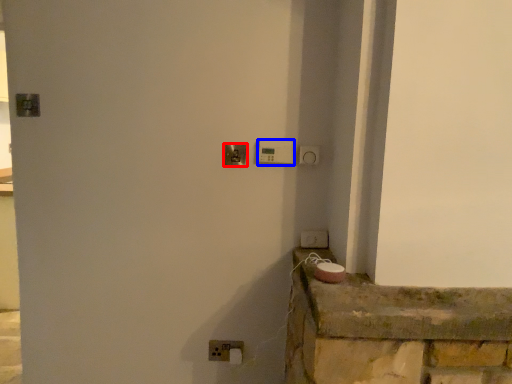
Question: Which point is further to the camera, door handle (highlighted by a red box) or light switch (highlighted by a blue box)?

Choices:
 (A) door handle
 (B) light switch

Answer: (A)